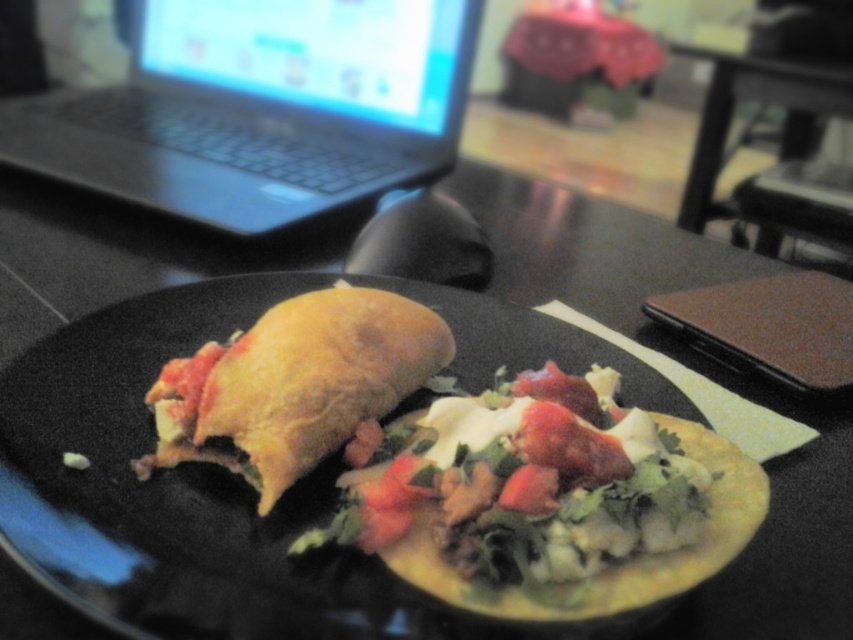
Between black plastic laptop at upper left and yellow tortilla at center, which one appears on the left side from the viewer's perspective?

Positioned to the left is black plastic laptop at upper left.

Is the position of black plastic laptop at upper left less distant than that of yellow tortilla at center?

No, black plastic laptop at upper left is further to the viewer.

Identify the location of black plastic laptop at upper left. (260, 108).

Identify the location of black plastic laptop at upper left. (260, 108).

Looking at this image, does black plastic laptop at upper left appear over black plastic table at center?

No.

Is black plastic laptop at upper left to the right of black plastic table at center from the viewer's perspective?

In fact, black plastic laptop at upper left is to the left of black plastic table at center.

Locate an element on the screen. The width and height of the screenshot is (853, 640). black plastic laptop at upper left is located at coordinates (260, 108).

Locate an element on the screen. The height and width of the screenshot is (640, 853). black plastic laptop at upper left is located at coordinates (260, 108).

Can you confirm if yellow tortilla at center is taller than golden brown tortilla at center?

Incorrect, yellow tortilla at center's height is not larger of golden brown tortilla at center's.

Who is more forward, (467, 556) or (161, 417)?

Point (467, 556) is more forward.

The image size is (853, 640). What do you see at coordinates (548, 500) in the screenshot?
I see `yellow tortilla at center` at bounding box center [548, 500].

This screenshot has height=640, width=853. In order to click on yellow tortilla at center in this screenshot , I will do `click(548, 500)`.